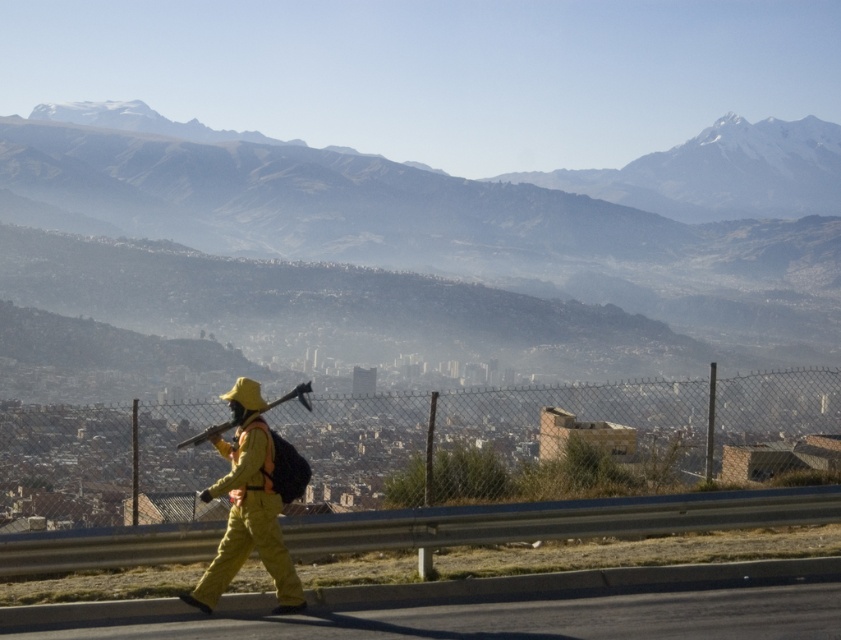
Between yellow fabric uniform at center and matte black ax at center, which one is positioned higher?

matte black ax at center is above.

Which is in front, point (218, 484) or point (281, 400)?

Point (218, 484) is in front.

Consider the image. Measure the distance between point (x=260, y=556) and camera.

The distance of point (x=260, y=556) from camera is 10.09 meters.

The image size is (841, 640). What are the coordinates of `yellow fabric uniform at center` in the screenshot? It's located at pos(252,500).

Can you confirm if black asphalt highway at lower center is taller than matte black ax at center?

No, black asphalt highway at lower center is not taller than matte black ax at center.

Does black asphalt highway at lower center appear over matte black ax at center?

Incorrect, black asphalt highway at lower center is not positioned above matte black ax at center.

The height and width of the screenshot is (640, 841). In order to click on black asphalt highway at lower center in this screenshot , I will do [532, 618].

Find the location of a particular element. The width and height of the screenshot is (841, 640). black asphalt highway at lower center is located at coordinates (532, 618).

Is black asphalt highway at lower center positioned behind yellow fabric uniform at center?

No.

Looking at this image, who is more distant from viewer, [696,628] or [205,596]?

Point [205,596]

Which is behind, point (363, 616) or point (274, 593)?

Point (274, 593)

This screenshot has width=841, height=640. In order to click on black asphalt highway at lower center in this screenshot , I will do `click(532, 618)`.